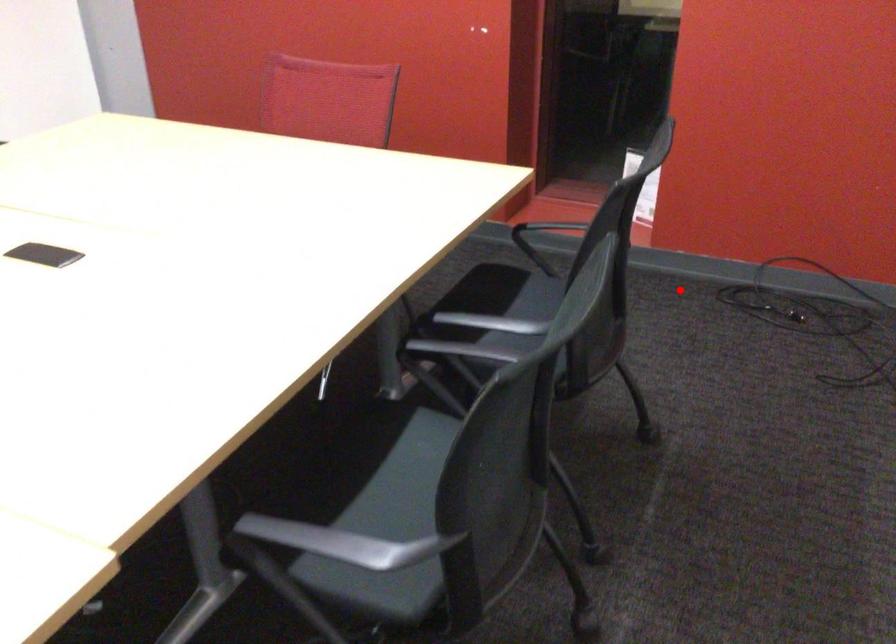
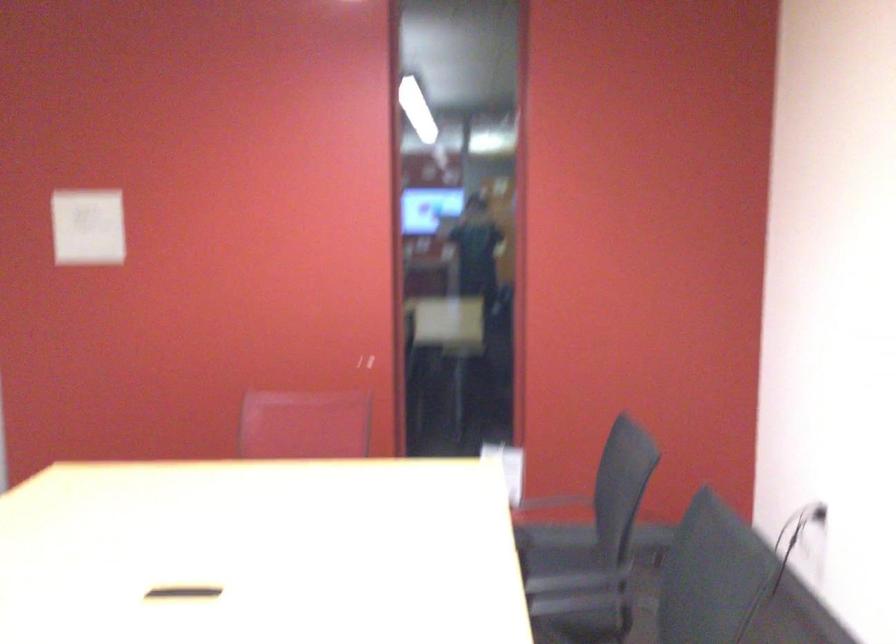
Find the pixel in the second image that matches the highlighted location in the first image.

(554, 547)